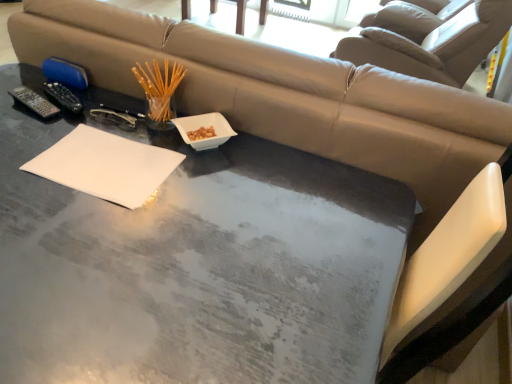
The image size is (512, 384). Find the location of `free location in front of white ceramic bowl at center`. free location in front of white ceramic bowl at center is located at coordinates (215, 187).